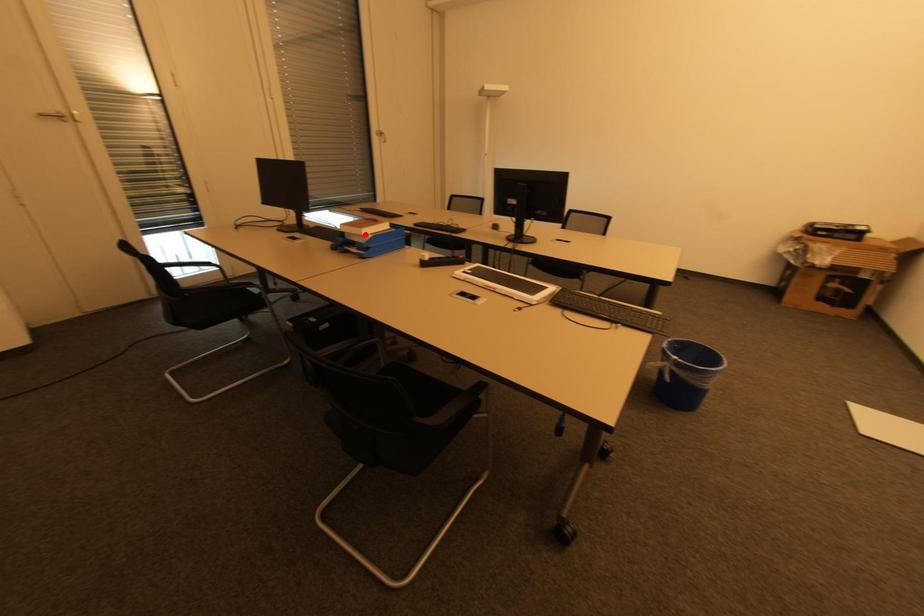
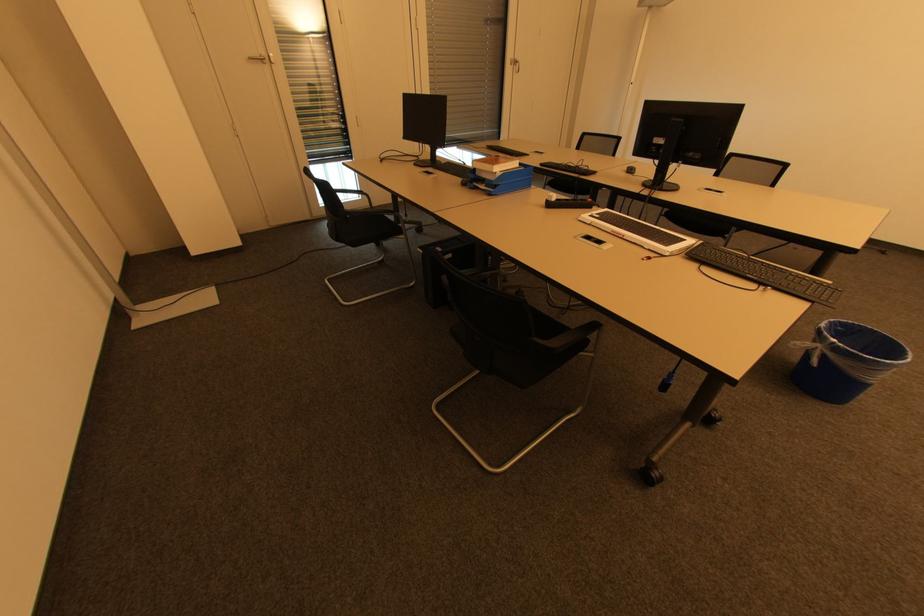
Question: I am providing you with two images of the same scene from different viewpoints. A red point is marked on the first image. Can you still see the location of the red point in image 2?

Choices:
 (A) Yes
 (B) No

Answer: (A)